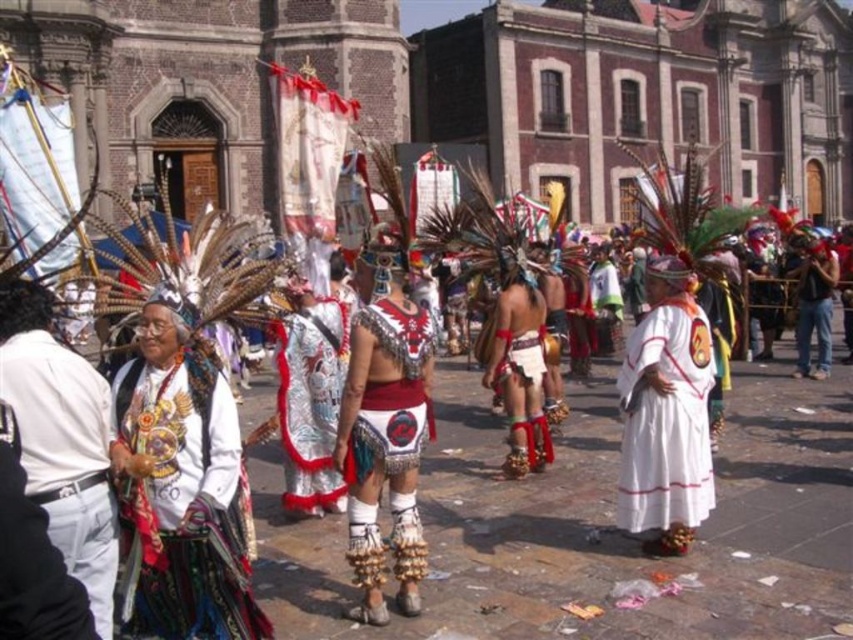
Question: Which point is closer to the camera?

Choices:
 (A) silver metallic headdress at center
 (B) white cotton dress at center

Answer: (B)

Question: Can you confirm if white cotton shirt at center is wider than silver metallic headdress at center?

Choices:
 (A) no
 (B) yes

Answer: (B)

Question: Based on their relative distances, which object is nearer to the silver metallic headdress at center?

Choices:
 (A) white cotton dress at center
 (B) embroidered velvet dress at center
 (C) white cotton shirt at center

Answer: (B)

Question: Does white cotton shirt at center have a larger size compared to white cotton dress at center?

Choices:
 (A) no
 (B) yes

Answer: (A)

Question: Estimate the real-world distances between objects in this image. Which object is closer to the white cotton dress at center?

Choices:
 (A) embroidered velvet dress at center
 (B) silver metallic headdress at center
 (C) silver metallic armor at center
 (D) white cotton shirt at center

Answer: (C)

Question: Is white cotton shirt at center smaller than silver metallic armor at center?

Choices:
 (A) no
 (B) yes

Answer: (A)